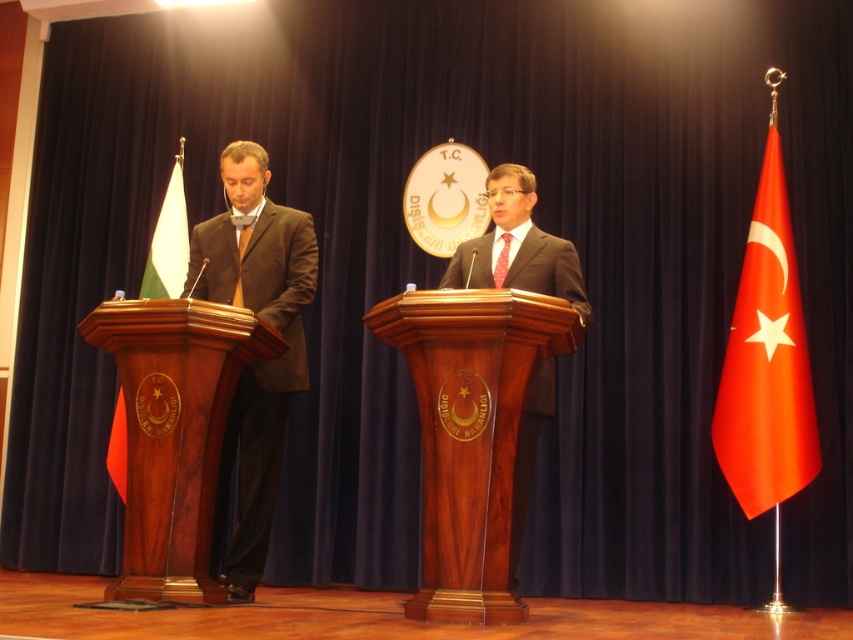
Based on the scene description, can you determine the spatial relationship between the wooden podium at center and the red fabric flag at right?

The wooden podium at center is positioned below the red fabric flag at right.

You are organizing a small event and need to place a 1.5 meter wide banner between the wooden podium at left and the white fabric flag at left. Based on their widths, will the banner fit between them?

The wooden podium at left is wider than the white fabric flag at left. Since the banner is 1.5 meters wide, it depends on the actual space between them. However, the description only provides their relative widths, not the distance between them. Therefore, we cannot determine if the banner will fit solely based on the given information.